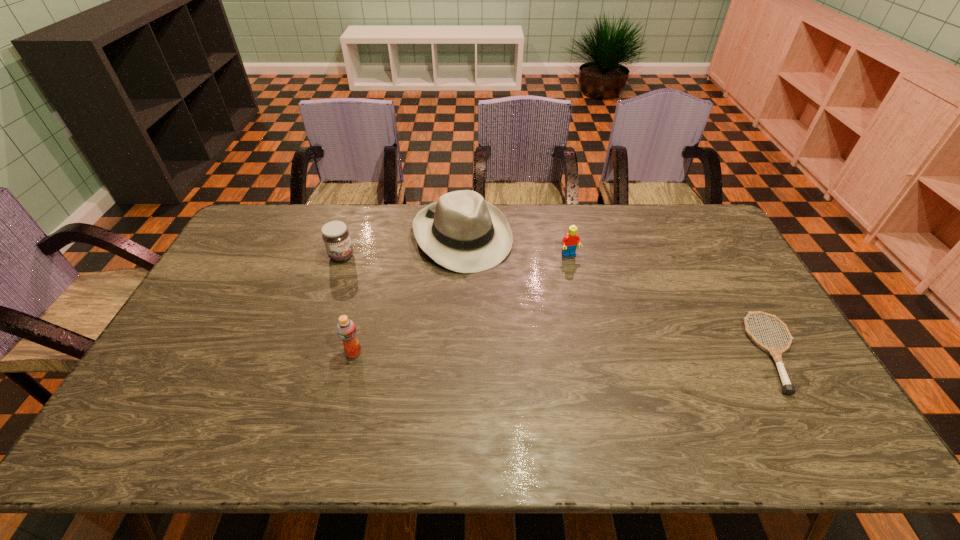
The width and height of the screenshot is (960, 540). I want to click on free area in between the third object from right to left and the leftmost object, so click(402, 246).

This screenshot has height=540, width=960. Identify the location of empty location between the fedora and the fourth object from left to right. (516, 246).

Find the location of `free area in between the tennis racket and the leftmost object`. free area in between the tennis racket and the leftmost object is located at coordinates (559, 305).

You are a GUI agent. You are given a task and a screenshot of the screen. Output one action in this format:
    pyautogui.click(x=<x>, y=<y>)
    Task: Click on the vacant space that's between the orange juice and the jam
    The image size is (960, 540).
    Given the screenshot: What is the action you would take?
    pyautogui.click(x=348, y=305)

At what (x,y) coordinates should I click in order to perform the action: click on empty space between the rightmost object and the fourth object from left to right. Please return your answer as a coordinate pair (x, y). The height and width of the screenshot is (540, 960). Looking at the image, I should click on (673, 304).

I want to click on empty space between the jam and the rightmost object, so click(x=559, y=305).

At what (x,y) coordinates should I click in order to perform the action: click on vacant area that lies between the fourth object from left to right and the fedora. Please return your answer as a coordinate pair (x, y). Looking at the image, I should click on (516, 246).

Identify which object is located as the fourth nearest to the tennis racket. Please provide its 2D coordinates. Your answer should be formatted as a tuple, i.e. [(x, y)], where the tuple contains the x and y coordinates of a point satisfying the conditions above.

[(335, 234)]

Locate which object ranks fourth in proximity to the second object from left to right. Please provide its 2D coordinates. Your answer should be formatted as a tuple, i.e. [(x, y)], where the tuple contains the x and y coordinates of a point satisfying the conditions above.

[(776, 353)]

Identify the location of vacant position in the image that satisfies the following two spatial constraints: 1. on the back side of the fedora; 2. on the left side of the leftmost object. (348, 236).